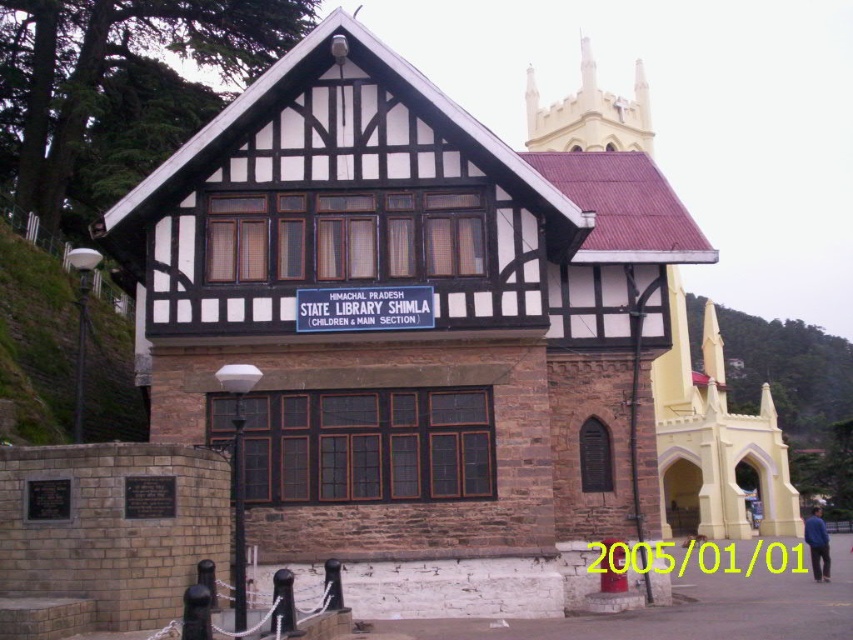
Question: Is brown stone chapel at center smaller than smooth yellow chapel at center?

Choices:
 (A) no
 (B) yes

Answer: (B)

Question: Observing the image, what is the correct spatial positioning of brown stone chapel at center in reference to smooth yellow chapel at center?

Choices:
 (A) below
 (B) above

Answer: (A)

Question: Which point is farther to the camera?

Choices:
 (A) (196, 282)
 (B) (577, 113)

Answer: (B)

Question: Which point appears farthest from the camera in this image?

Choices:
 (A) (305, 252)
 (B) (730, 429)

Answer: (B)

Question: From the image, what is the correct spatial relationship of brown stone chapel at center in relation to smooth yellow chapel at center?

Choices:
 (A) left
 (B) right

Answer: (A)

Question: Which point is farther to the camera?

Choices:
 (A) (196, 308)
 (B) (718, 529)

Answer: (B)